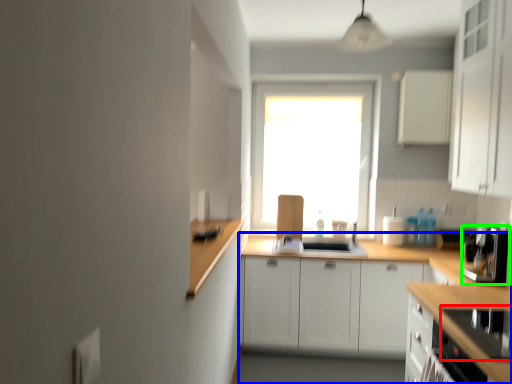
Question: Based on their relative distances, which object is nearer to appliance (highlighted by a red box)? Choose from countertop (highlighted by a blue box) and coffee machine (highlighted by a green box).

Choices:
 (A) countertop
 (B) coffee machine

Answer: (B)